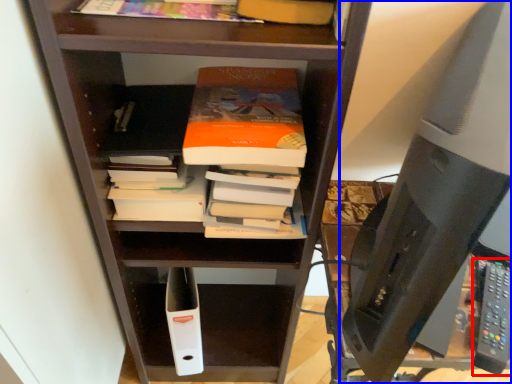
Question: Which object is closer to the camera taking this photo, remote (highlighted by a red box) or desktop computer (highlighted by a blue box)?

Choices:
 (A) remote
 (B) desktop computer

Answer: (B)